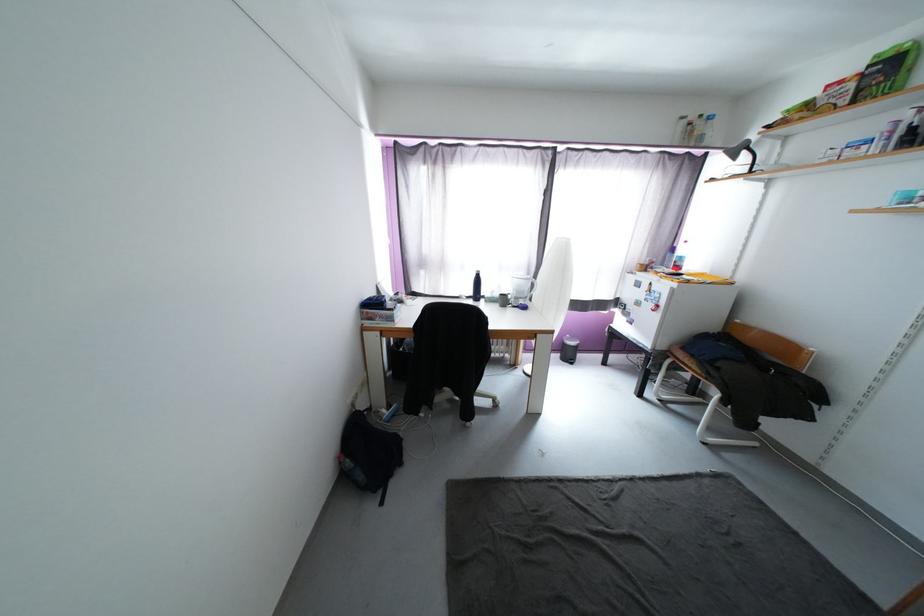
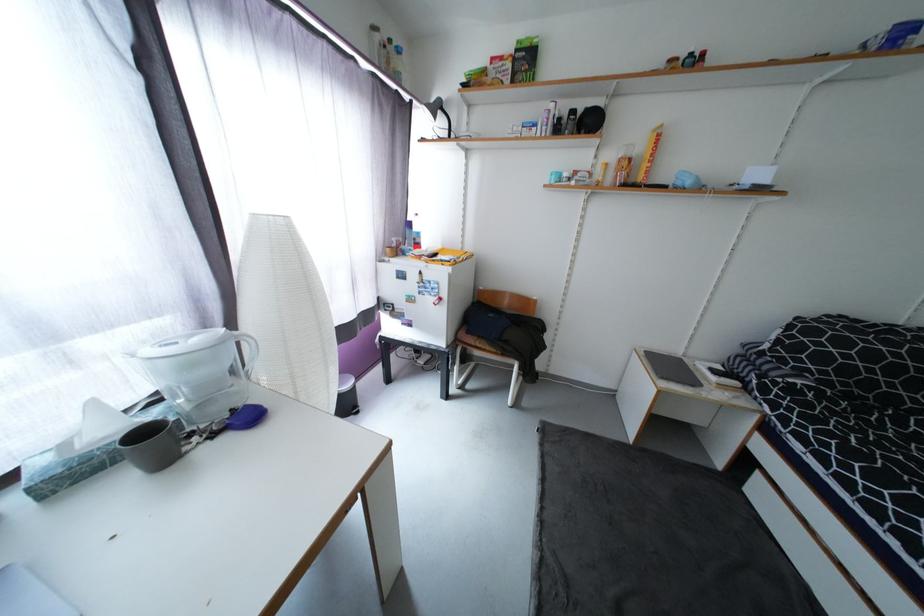
In the second image, find the point that corresponds to pixel 699 368 in the first image.

(493, 349)